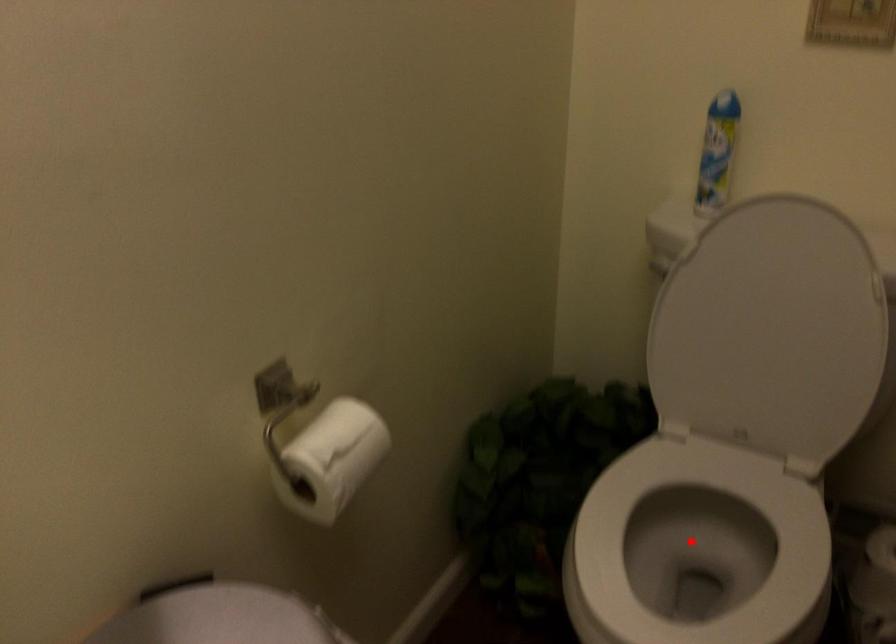
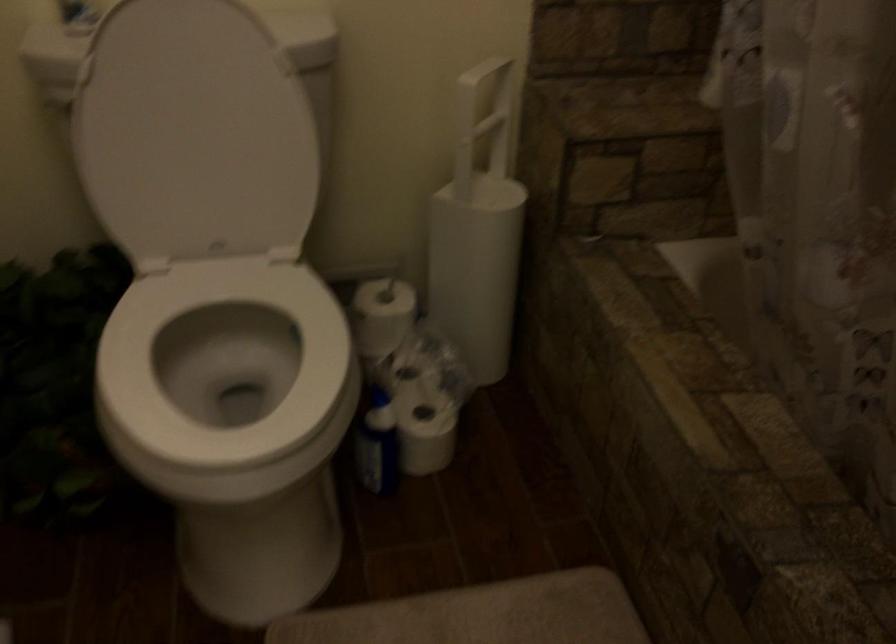
Locate, in the second image, the point that corresponds to the highlighted location in the first image.

(224, 365)